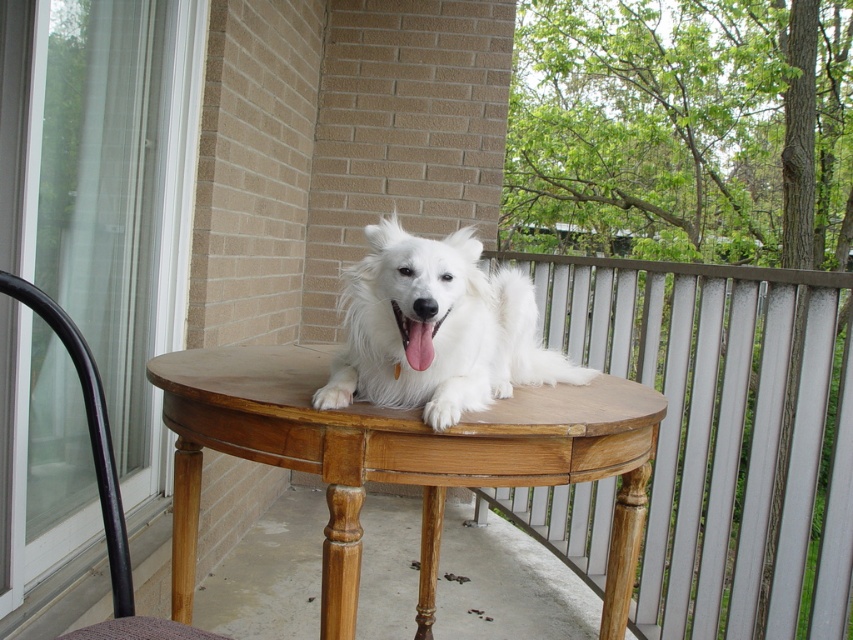
You are standing on the balcony and want to place a small plant pot at the point marked by coordinates point [726,435]. Is this point located on the wooden table at center?

Yes, the point [726,435] is on the wooden table at center, so placing the plant pot there would be appropriate.

You are a photographer standing on the balcony. You want to take a photo of the white fluffy dog at center so that its entire body fits in the frame. Considering the light brown wooden table at center, which is higher than the dog, should you stand on the table or stay on the ground to get a better angle?

Since the light brown wooden table at center is higher than the white fluffy dog at center, standing on the table would place you at a higher angle, allowing you to capture the dog from above. Alternatively, staying on the ground would give a lower perspective. However, to ensure the entire body of the white fluffy dog at center fits in the frame while accounting for the table height, staying on the ground might be better to avoid cropping the bottom of the dog. But the exact positioning depends on the lens